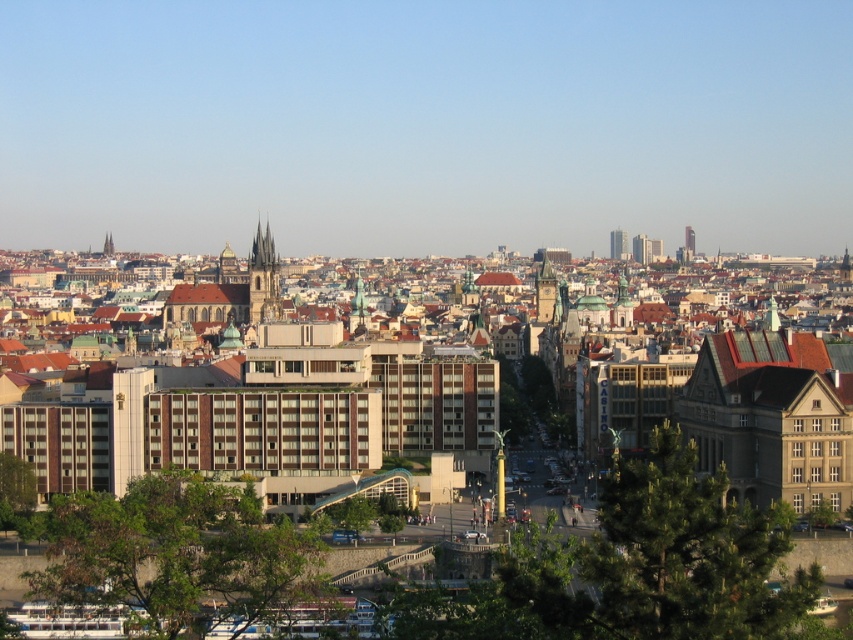
You are an architect analyzing the cityscape. You notice the glassy modern skyscraper at upper right and the brown stone tower at upper center. Which of these two structures is positioned lower in the image?

The glassy modern skyscraper at upper right is located below the brown stone tower at upper center, so it is positioned lower in the image.

You are an architect analyzing the city layout. Based on the coordinates provided, where is the glassy modern skyscraper at upper right located in the image?

The glassy modern skyscraper at upper right is located at coordinates point [689,240] in the image.

You are an architect analyzing the city layout. Based on the scene, which object is positioned higher in the image, the golden stone clock tower at center or the glassy modern skyscraper at upper right?

The glassy modern skyscraper at upper right is positioned higher in the image than the golden stone clock tower at center according to the description.